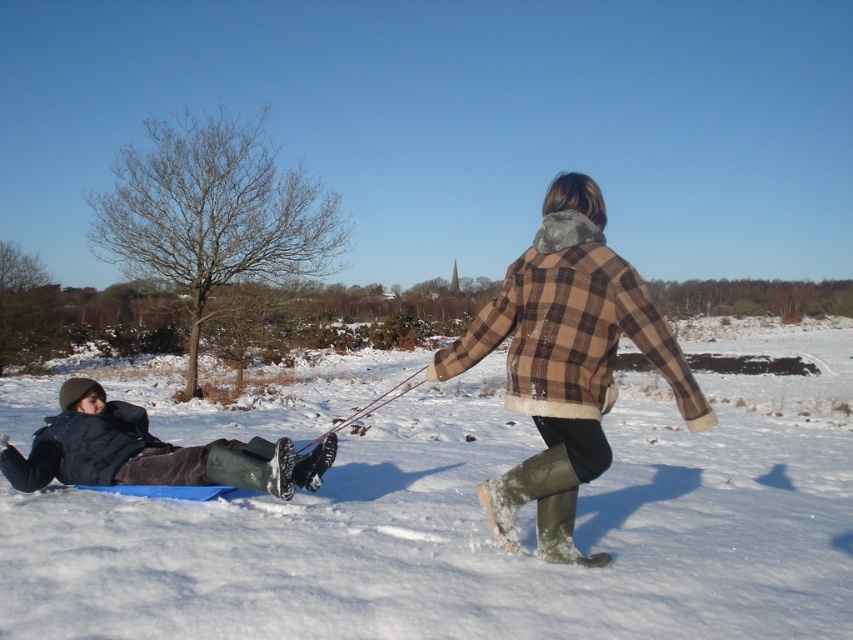
You are standing at the edge of a snowy field and see the white fluffy snow at center. If you want to place a 3.5 meter long fence from your current position to the snow, will it be long enough to reach the snow?

The distance between you and the white fluffy snow at center is 3.20 meters. Since the fence is 3.5 meters long, it will be long enough to reach the snow.

You are trying to decide which item is more suitable for a cold winter day. Based on the scene, which object is thicker between the plaid woolen coat at center and the dark blue fabric at lower left?

The dark blue fabric at lower left is thicker than the plaid woolen coat at center, so it would be more suitable for a cold winter day.

You are standing in the snowy landscape and want to take a photo of the white fluffy snow at center and the plaid woolen coat at center. Which object should you focus on first to ensure it appears sharp in the photo?

You should focus on the white fluffy snow at center first because it is closer to the viewer than the plaid woolen coat at center, so focusing on the closer object ensures it will be sharp.